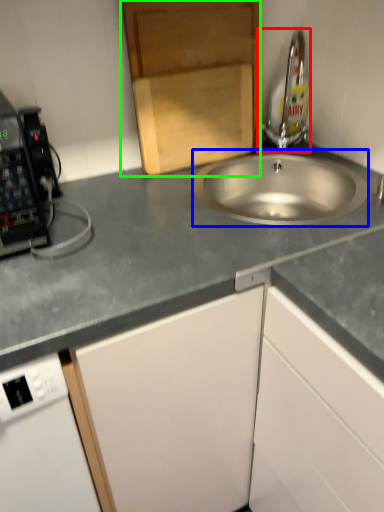
Question: Estimate the real-world distances between objects in this image. Which object is closer to tap (highlighted by a red box), sink (highlighted by a blue box) or cabinetry (highlighted by a green box)?

Choices:
 (A) sink
 (B) cabinetry

Answer: (A)